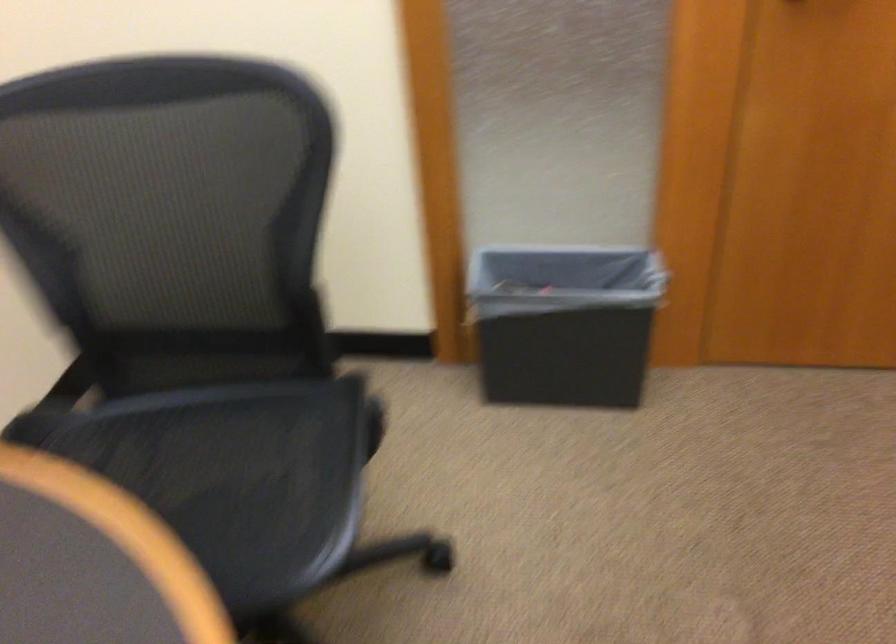
Where is `dark trash can`? The width and height of the screenshot is (896, 644). dark trash can is located at coordinates (564, 323).